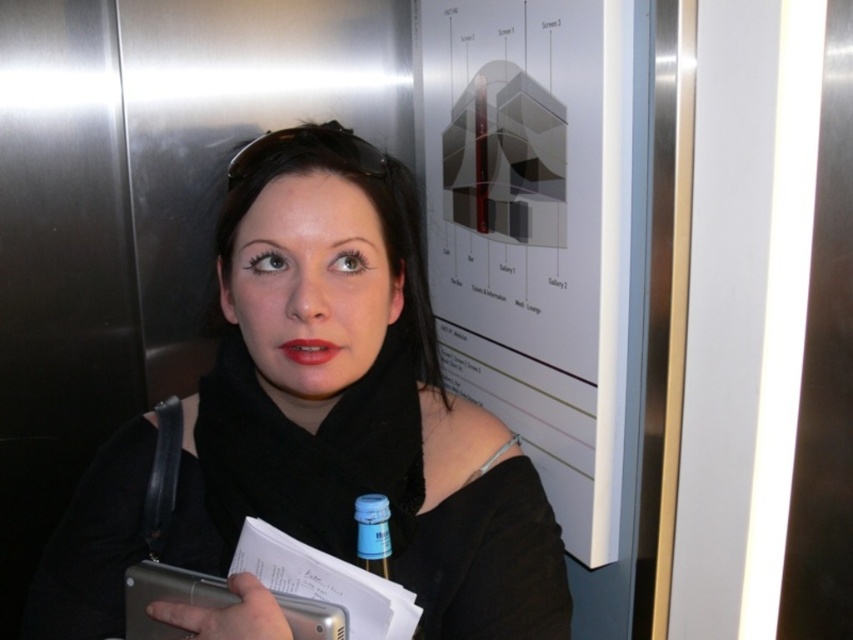
You are a security guard in the building and need to check the items the woman is holding. Which item is nearer to you between the black matte scarf at center and the blue plastic bottle at center?

The black matte scarf at center is closer to the viewer than the blue plastic bottle at center, so the security guard should check the black matte scarf at center first as it is nearer.

You are a delivery robot in an elevator. You need to place a package on the floor near the blue plastic bottle at center. Where should you place the package?

Place the package near the coordinates where the blue plastic bottle at center is located, which is at point (372, 532).

You are standing in the same room as the woman in the image. You need to determine which of the two points, point (373,534) or point (329,340), is closer to you. Which one is closer?

Point (373,534) is closer to the viewer than point (329,340).